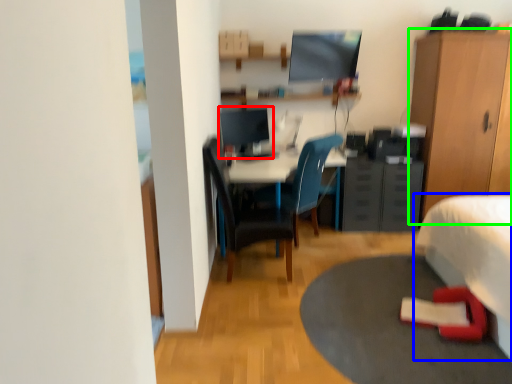
Question: Which object is the closest to the computer monitor (highlighted by a red box)? Choose among these: bed (highlighted by a blue box) or cabinetry (highlighted by a green box).

Choices:
 (A) bed
 (B) cabinetry

Answer: (B)